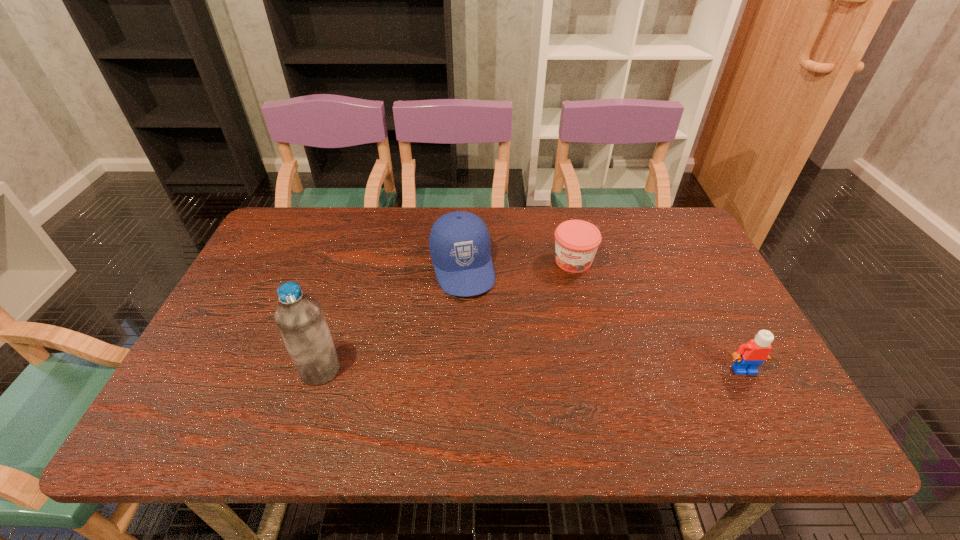
Locate an element on the screen. The image size is (960, 540). vacant space situated 0.130m on the front-facing side of the third object from right to left is located at coordinates (480, 335).

This screenshot has height=540, width=960. What are the coordinates of `vacant space situated on the front label of the jam` in the screenshot? It's located at (560, 296).

Identify the location of vacant area located 0.120m on the front label of the jam. (557, 303).

Find the location of a particular element. This screenshot has height=540, width=960. free spot located on the front label of the jam is located at coordinates (559, 299).

Identify the location of cap that is at the far edge. The width and height of the screenshot is (960, 540). (459, 242).

Where is `jam at the far edge`? jam at the far edge is located at coordinates (576, 241).

At what (x,y) coordinates should I click in order to perform the action: click on water bottle that is positioned at the near edge. Please return your answer as a coordinate pair (x, y). This screenshot has width=960, height=540. Looking at the image, I should click on (300, 320).

Identify the location of Lego that is at the near edge. The width and height of the screenshot is (960, 540). pos(748,357).

Where is `object that is positioned at the right edge`? The height and width of the screenshot is (540, 960). object that is positioned at the right edge is located at coordinates pos(748,357).

Find the location of `object that is at the near right corner`. object that is at the near right corner is located at coordinates (748, 357).